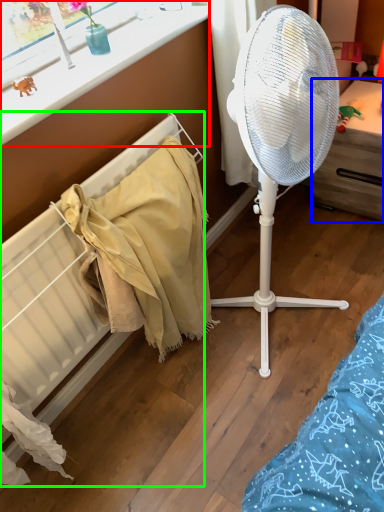
Question: Based on their relative distances, which object is farther from window frame (highlighted by a red box)? Choose from furniture (highlighted by a blue box) and radiator (highlighted by a green box).

Choices:
 (A) furniture
 (B) radiator

Answer: (A)